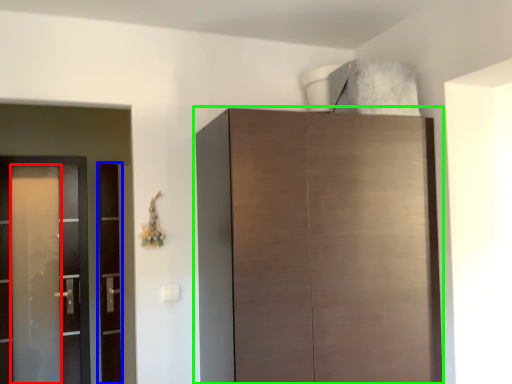
Question: Which object is positioned farthest from screen door (highlighted by a red box)? Select from screen door (highlighted by a blue box) and cupboard (highlighted by a green box).

Choices:
 (A) screen door
 (B) cupboard

Answer: (B)